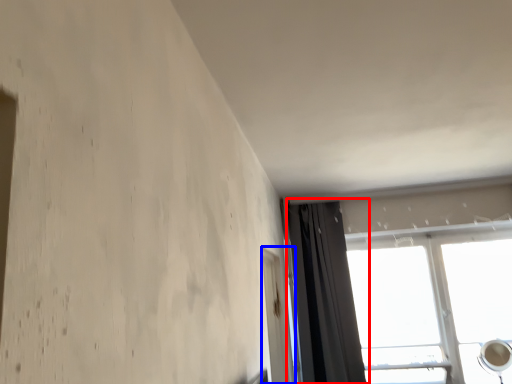
Question: Which object appears farthest to the camera in this image, curtain (highlighted by a red box) or screen door (highlighted by a blue box)?

Choices:
 (A) curtain
 (B) screen door

Answer: (A)